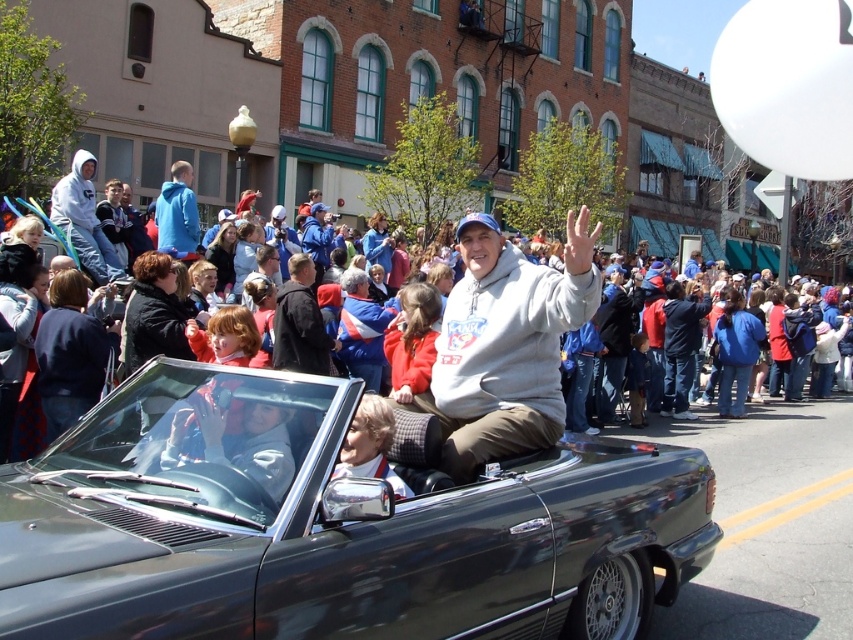
Looking at this image, which is below, gray fleece sweatshirt at center or blue fleece jacket at upper left?

gray fleece sweatshirt at center

Who is more distant from viewer, (508,284) or (173,186)?

The point (173,186) is more distant.

What do you see at coordinates (506, 344) in the screenshot?
I see `gray fleece sweatshirt at center` at bounding box center [506, 344].

Where is `gray fleece sweatshirt at center`? The image size is (853, 640). gray fleece sweatshirt at center is located at coordinates (506, 344).

Is point (334, 577) less distant than point (107, 244)?

Yes, it is.

Between shiny black convertible at center and matte gray hoodie at left, which one is positioned lower?

shiny black convertible at center

Is point (199, 566) positioned before point (67, 202)?

Yes.

Locate an element on the screen. This screenshot has width=853, height=640. shiny black convertible at center is located at coordinates (329, 525).

Between red jackets at center and matte gray hoodie at left, which one is positioned higher?

matte gray hoodie at left is higher up.

Who is shorter, red jackets at center or matte gray hoodie at left?

Standing shorter between the two is red jackets at center.

Does point (799, 433) come farther from viewer compared to point (59, 186)?

Yes, it is.

You are a GUI agent. You are given a task and a screenshot of the screen. Output one action in this format:
    pyautogui.click(x=<x>, y=<y>)
    Task: Click on the red jackets at center
    The image size is (853, 640).
    Given the screenshot: What is the action you would take?
    pyautogui.click(x=769, y=440)